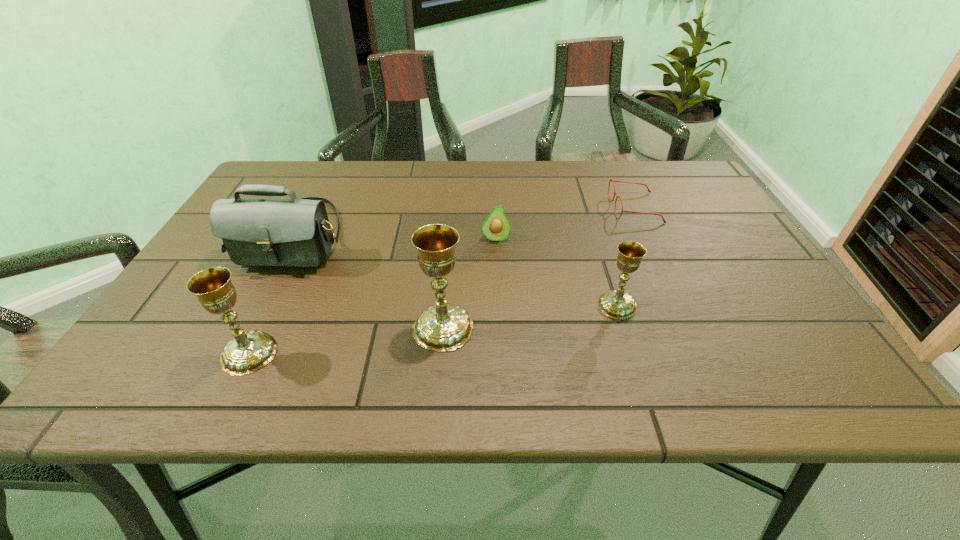
The width and height of the screenshot is (960, 540). In order to click on vacant space at the far edge in this screenshot , I will do `click(369, 196)`.

Find the location of a particular element. vacant space at the near edge of the desktop is located at coordinates (702, 339).

In the image, there is a desktop. What are the coordinates of `free space at the right edge` in the screenshot? It's located at (768, 274).

At what (x,y) coordinates should I click in order to perform the action: click on blank space at the far left corner. Please return your answer as a coordinate pair (x, y). The height and width of the screenshot is (540, 960). Looking at the image, I should click on (270, 180).

The height and width of the screenshot is (540, 960). In order to click on free space at the near left corner of the desktop in this screenshot , I will do `click(157, 326)`.

Image resolution: width=960 pixels, height=540 pixels. What are the coordinates of `vacant region at the near right corner of the desktop` in the screenshot? It's located at (793, 333).

Identify the location of free space between the second chalice from right to left and the rightmost object. This screenshot has width=960, height=540. (539, 268).

Locate an element on the screen. vacant area between the fifth object from left to right and the second chalice from left to right is located at coordinates (530, 316).

Find the location of `vacant point located between the shoulder bag and the spectacles`. vacant point located between the shoulder bag and the spectacles is located at coordinates (465, 222).

You are a GUI agent. You are given a task and a screenshot of the screen. Output one action in this format:
    pyautogui.click(x=<x>, y=<y>)
    Task: Click on the unoccupied area between the second chalice from right to left and the fifth tallest object
    This screenshot has width=960, height=540.
    Given the screenshot: What is the action you would take?
    pyautogui.click(x=469, y=283)